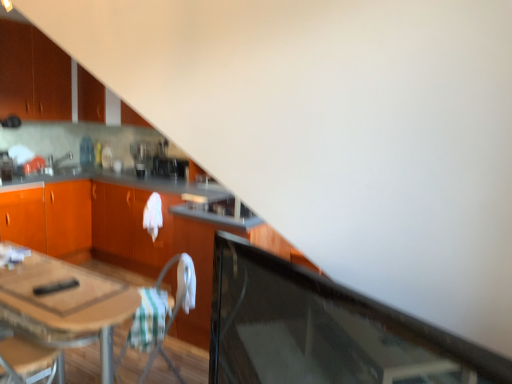
At what (x,y) coordinates should I click in order to perform the action: click on free space behind matte silver sink at upper left. Please return your answer as a coordinate pair (x, y). Looking at the image, I should click on (x=73, y=168).